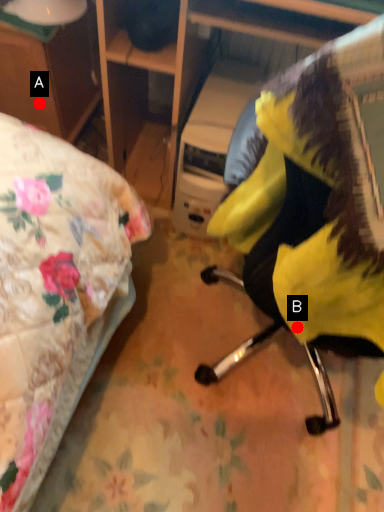
Question: Two points are circled on the image, labeled by A and B beside each circle. Which point is closer to the camera taking this photo?

Choices:
 (A) A is closer
 (B) B is closer

Answer: (B)